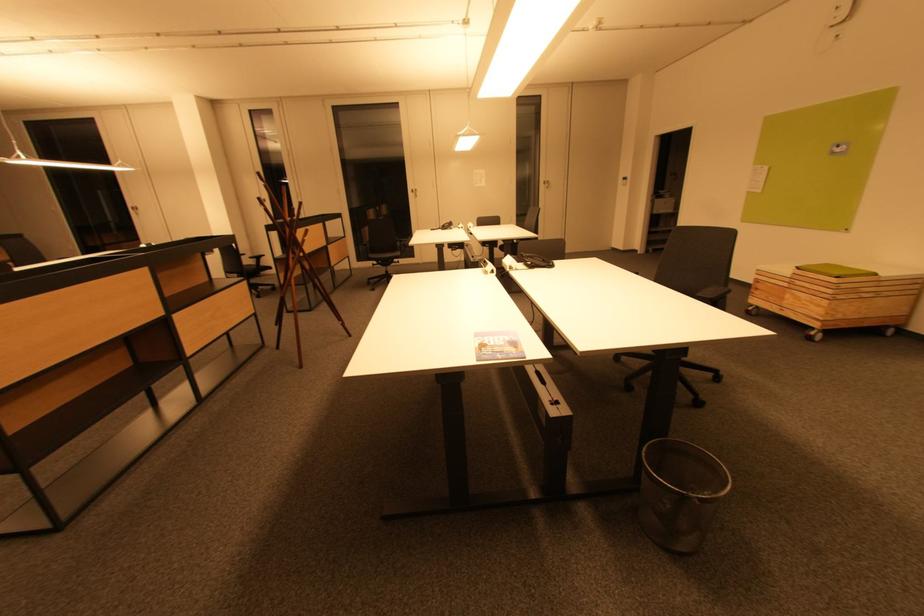
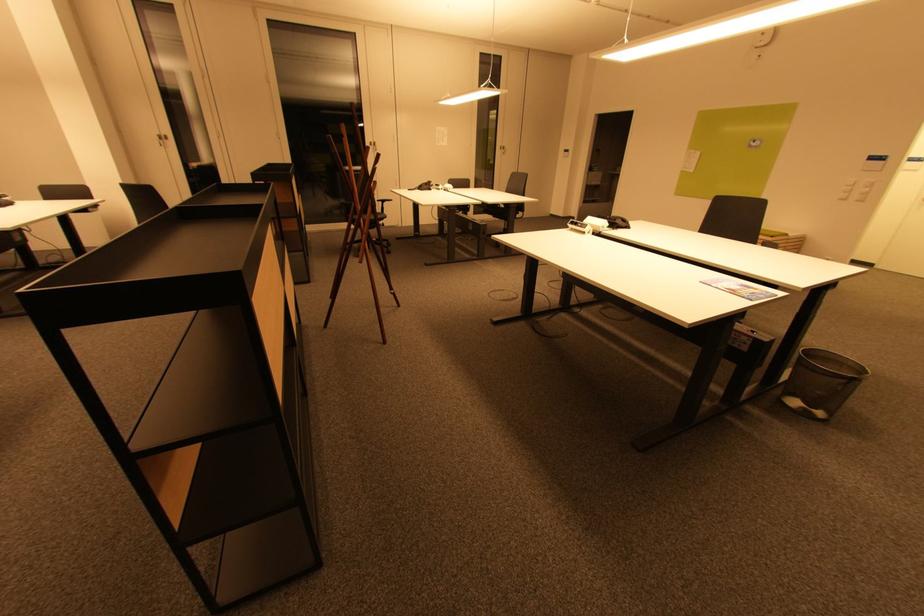
Where in the second image is the point corresponding to point (479, 172) from the first image?

(442, 130)